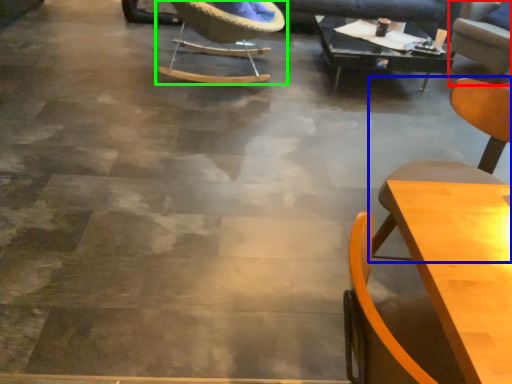
Question: Based on their relative distances, which object is nearer to chair (highlighted by a red box)? Choose from chair (highlighted by a blue box) and chair (highlighted by a green box).

Choices:
 (A) chair
 (B) chair

Answer: (B)